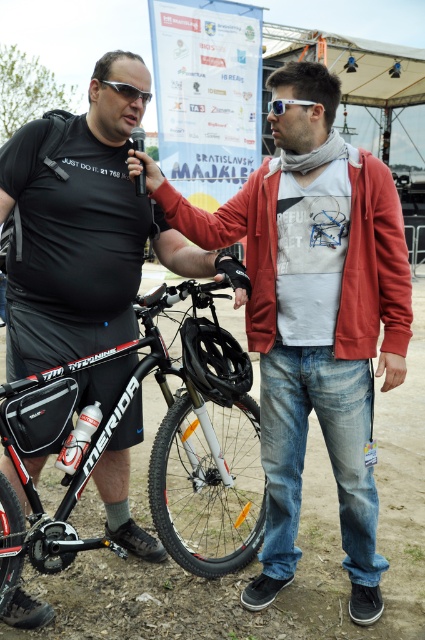
You are a photographer trying to capture a clear shot of the black matte bicycle at center and the matte black sunglasses at upper left. Based on their positions, which object should you focus on first if you want to start from the lowest point in the image?

The black matte bicycle at center is below matte black sunglasses at upper left, so you should focus on the black matte bicycle at center first as it is lower in the image.

You are a photographer trying to capture a closeup of the Merida bicycle. You want to focus on the part of the bike nearest to the camera. Which coordinate point, point [87,476] or point [232,344], should you aim your camera at?

Point [87,476] is closer to the camera than point [232,344], so you should aim your camera at point [87,476] to capture the closest part of the Merida bicycle.

Consider the image. You are a delivery robot that needs to move from your current position to the matte black sunglasses at upper left. There is a black matte bicycle at center in your path. Can you go around the bicycle to reach the sunglasses without moving the bicycle?

The black matte bicycle at center is 2.33 meters away from the matte black sunglasses at upper left. Since the distance between them is sufficient, the robot can navigate around the bicycle to reach the sunglasses without needing to move the bicycle.